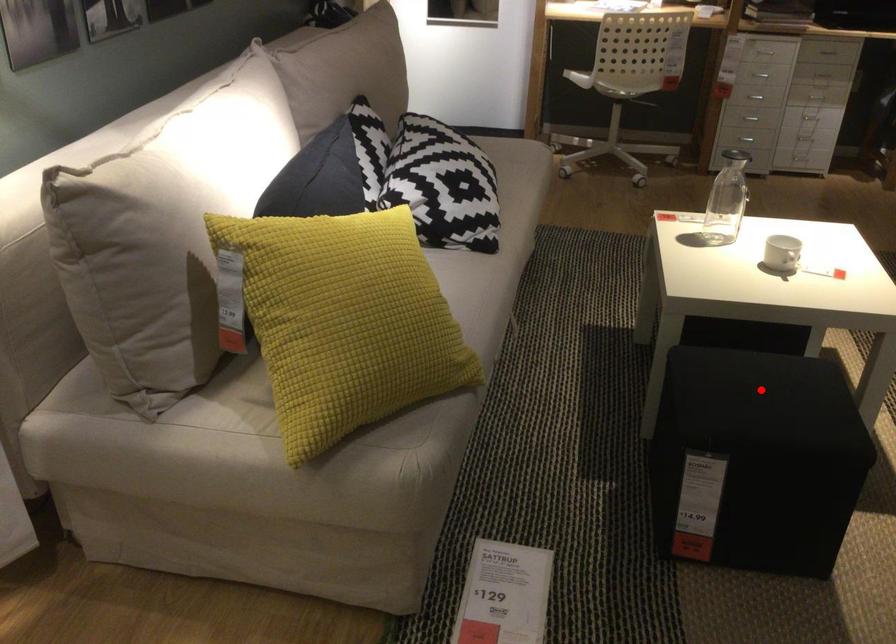
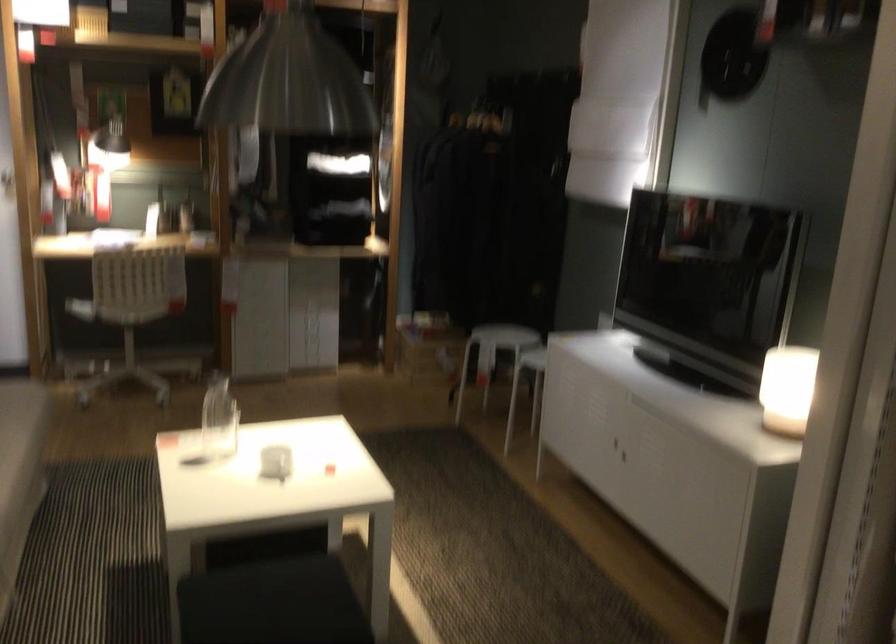
The point at the highlighted location is marked in the first image. Where is the corresponding point in the second image?

(271, 603)